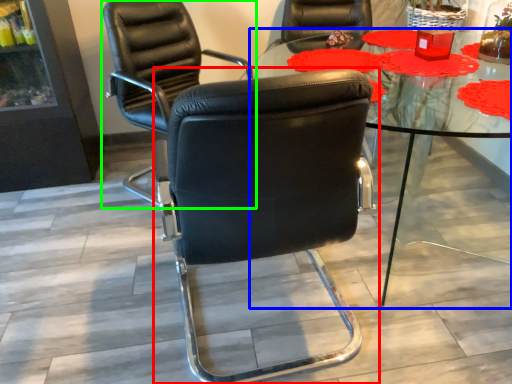
Question: Based on their relative distances, which object is nearer to chair (highlighted by a red box)? Choose from table (highlighted by a blue box) and chair (highlighted by a green box).

Choices:
 (A) table
 (B) chair

Answer: (A)